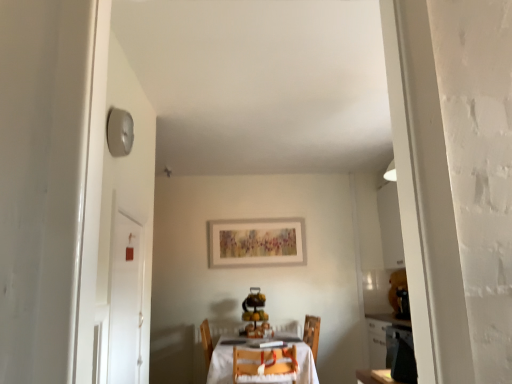
Question: Considering the relative positions of wooden chair at center and white glossy door at left in the image provided, is wooden chair at center to the left of white glossy door at left from the viewer's perspective?

Choices:
 (A) no
 (B) yes

Answer: (A)

Question: From a real-world perspective, is wooden chair at center on white glossy door at left?

Choices:
 (A) yes
 (B) no

Answer: (B)

Question: Is white glossy door at left inside wooden chair at center?

Choices:
 (A) no
 (B) yes

Answer: (A)

Question: Does wooden chair at center have a smaller size compared to white glossy door at left?

Choices:
 (A) yes
 (B) no

Answer: (B)

Question: Could you tell me if wooden chair at center is turned towards white glossy door at left?

Choices:
 (A) yes
 (B) no

Answer: (B)

Question: Is wooden chair at center further to the viewer compared to white glossy door at left?

Choices:
 (A) yes
 (B) no

Answer: (A)

Question: Would you say white glossy door at left is a long distance from white wooden table at center?

Choices:
 (A) no
 (B) yes

Answer: (B)

Question: Considering the relative positions of white glossy door at left and white wooden table at center in the image provided, is white glossy door at left behind white wooden table at center?

Choices:
 (A) yes
 (B) no

Answer: (B)

Question: Is white wooden table at center at the back of white glossy door at left?

Choices:
 (A) yes
 (B) no

Answer: (B)

Question: Considering the relative sizes of white glossy door at left and white wooden table at center in the image provided, is white glossy door at left bigger than white wooden table at center?

Choices:
 (A) no
 (B) yes

Answer: (A)

Question: Is white glossy door at left not inside white wooden table at center?

Choices:
 (A) no
 (B) yes

Answer: (B)

Question: Is white glossy door at left oriented towards white wooden table at center?

Choices:
 (A) yes
 (B) no

Answer: (B)

Question: Does white wooden table at center lie in front of white glossy door at left?

Choices:
 (A) yes
 (B) no

Answer: (B)